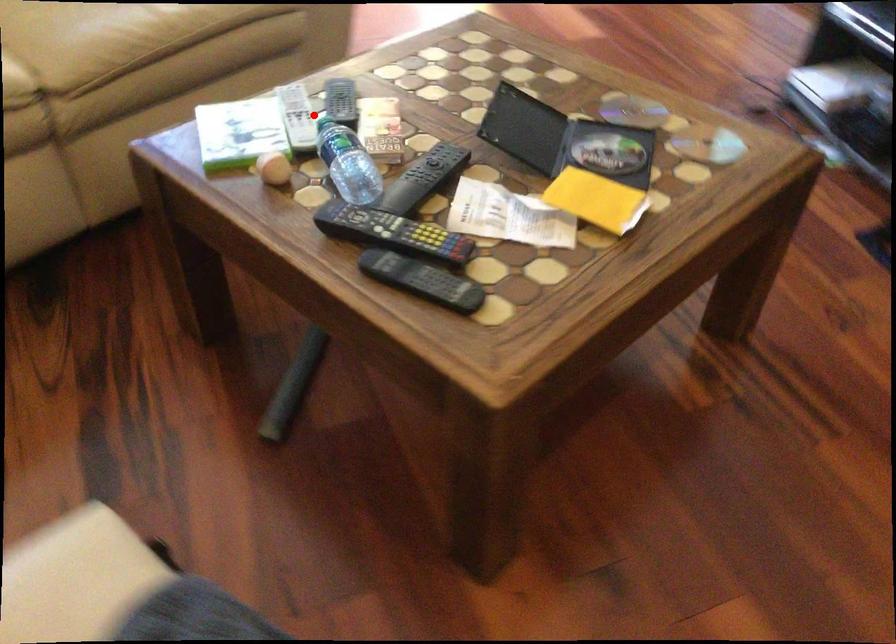
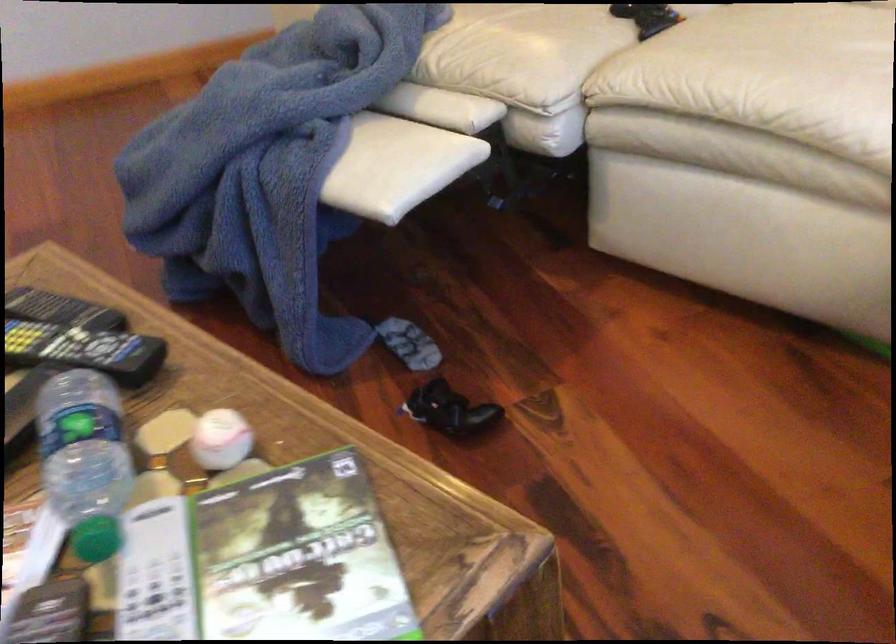
Question: A red point is marked in image1. In image2, is the corresponding 3D point closer to the camera or farther? Reply with the corresponding letter.

Choices:
 (A) The corresponding 3D point is closer.
 (B) The corresponding 3D point is farther.

Answer: (A)